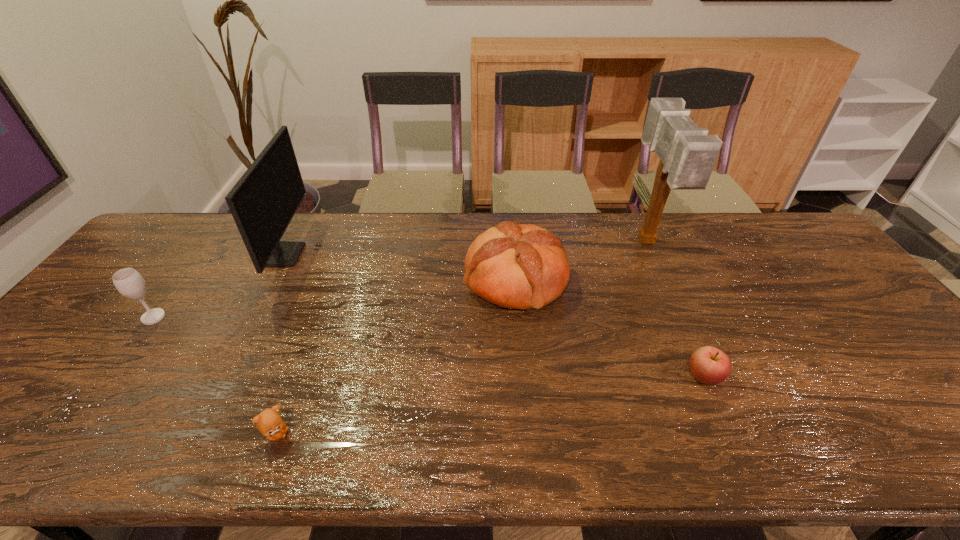
What are the coordinates of `mallet` in the screenshot? It's located at (687, 154).

You are a GUI agent. You are given a task and a screenshot of the screen. Output one action in this format:
    pyautogui.click(x=<x>, y=<y>)
    Task: Click on the fifth shortest object
    The height and width of the screenshot is (540, 960).
    Given the screenshot: What is the action you would take?
    point(264,200)

You are a GUI agent. You are given a task and a screenshot of the screen. Output one action in this format:
    pyautogui.click(x=<x>, y=<y>)
    Task: Click on the second object from left to right
    
    Given the screenshot: What is the action you would take?
    pyautogui.click(x=264, y=200)

The width and height of the screenshot is (960, 540). What are the coordinates of `bread` in the screenshot? It's located at (524, 266).

This screenshot has height=540, width=960. What are the coordinates of `wineglass` in the screenshot? It's located at (129, 282).

Locate an element on the screen. apple is located at coordinates (709, 365).

Find the location of a particular element. Image resolution: width=960 pixels, height=540 pixels. teddy bear is located at coordinates (269, 422).

I want to click on the fourth object from right to left, so click(269, 422).

You are a GUI agent. You are given a task and a screenshot of the screen. Output one action in this format:
    pyautogui.click(x=<x>, y=<y>)
    Task: Click on the vacant region located on the right of the tallest object
    The image size is (960, 540).
    Given the screenshot: What is the action you would take?
    pyautogui.click(x=756, y=243)

The width and height of the screenshot is (960, 540). Find the location of `blank space located on the front-facing side of the second object from left to right`. blank space located on the front-facing side of the second object from left to right is located at coordinates (342, 255).